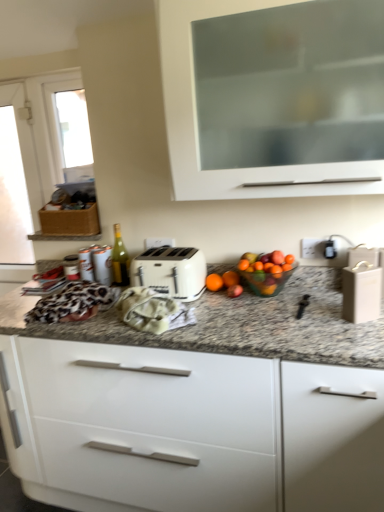
Question: Would you say beige matte wine box at right, the second appliance viewed from the back, is part of white glossy cabinet at center, marked as the 1th cabinetry in a bottom-to-top arrangement,'s contents?

Choices:
 (A) yes
 (B) no

Answer: (A)

Question: Does white glossy cabinet at center, marked as the 1th cabinetry in a bottom-to-top arrangement, turn towards beige matte wine box at right, the second appliance viewed from the back?

Choices:
 (A) yes
 (B) no

Answer: (B)

Question: Is white glossy cabinet at center, which is counted as the second cabinetry, starting from the top, not inside beige matte wine box at right, positioned as the first appliance in right-to-left order?

Choices:
 (A) yes
 (B) no

Answer: (A)

Question: Is white glossy cabinet at center, marked as the 1th cabinetry in a bottom-to-top arrangement, behind beige matte wine box at right, positioned as the first appliance in right-to-left order?

Choices:
 (A) no
 (B) yes

Answer: (A)

Question: From a real-world perspective, is white glossy cabinet at center, marked as the 1th cabinetry in a bottom-to-top arrangement, below beige matte wine box at right, the second appliance viewed from the back?

Choices:
 (A) no
 (B) yes

Answer: (B)

Question: Is white glossy cabinet at center, marked as the 1th cabinetry in a bottom-to-top arrangement, taller or shorter than transparent glass window at upper left?

Choices:
 (A) short
 (B) tall

Answer: (B)

Question: In the image, is white glossy cabinet at center, marked as the 1th cabinetry in a bottom-to-top arrangement, positioned in front of or behind transparent glass window at upper left?

Choices:
 (A) front
 (B) behind

Answer: (A)

Question: Is white glossy cabinet at center, marked as the 1th cabinetry in a bottom-to-top arrangement, spatially inside transparent glass window at upper left, or outside of it?

Choices:
 (A) outside
 (B) inside

Answer: (A)

Question: In the image, is white glossy cabinet at center, marked as the 1th cabinetry in a bottom-to-top arrangement, on the left side or the right side of transparent glass window at upper left?

Choices:
 (A) right
 (B) left

Answer: (A)

Question: Relative to translucent glass bowl at center, is green glass bottle at center in front or behind?

Choices:
 (A) front
 (B) behind

Answer: (B)

Question: Is green glass bottle at center wider or thinner than translucent glass bowl at center?

Choices:
 (A) thin
 (B) wide

Answer: (A)

Question: Considering the relative positions of green glass bottle at center and translucent glass bowl at center in the image provided, is green glass bottle at center to the left or to the right of translucent glass bowl at center?

Choices:
 (A) right
 (B) left

Answer: (B)

Question: Is point (124, 279) positioned closer to the camera than point (248, 270)?

Choices:
 (A) farther
 (B) closer

Answer: (A)

Question: Is orange matte at center bigger or smaller than leopard print fabric at center?

Choices:
 (A) big
 (B) small

Answer: (B)

Question: Considering their positions, is orange matte at center located in front of or behind leopard print fabric at center?

Choices:
 (A) behind
 (B) front

Answer: (A)